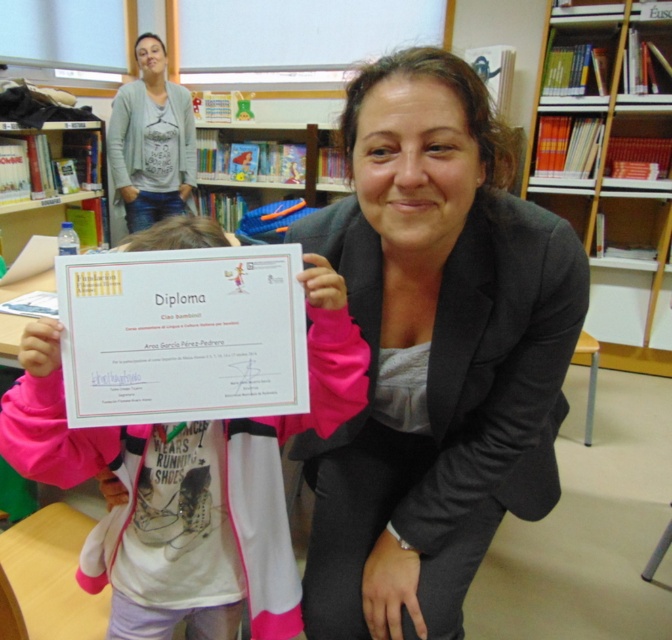
Is pink fabric at center positioned behind wooden bookshelf at upper right?

No.

Looking at this image, which is more to the left, pink fabric at center or wooden bookshelf at upper right?

pink fabric at center

The width and height of the screenshot is (672, 640). In order to click on pink fabric at center in this screenshot , I will do `click(190, 484)`.

Between point (392, 136) and point (588, 118), which one is positioned in front?

Positioned in front is point (392, 136).

Which of these two, matte black blazer at center or wooden bookshelf at upper right, stands shorter?

matte black blazer at center is shorter.

Is point (407, 262) positioned before point (589, 49)?

That is True.

Find the location of `matte black blazer at center`. matte black blazer at center is located at coordinates (433, 353).

Can you confirm if matte black blazer at center is thinner than pink fabric at center?

Correct, matte black blazer at center's width is less than pink fabric at center's.

Does matte black blazer at center come behind pink fabric at center?

No, it is in front of pink fabric at center.

Which is behind, point (487, 387) or point (202, 634)?

Positioned behind is point (202, 634).

Image resolution: width=672 pixels, height=640 pixels. Find the location of `matte black blazer at center`. matte black blazer at center is located at coordinates (433, 353).